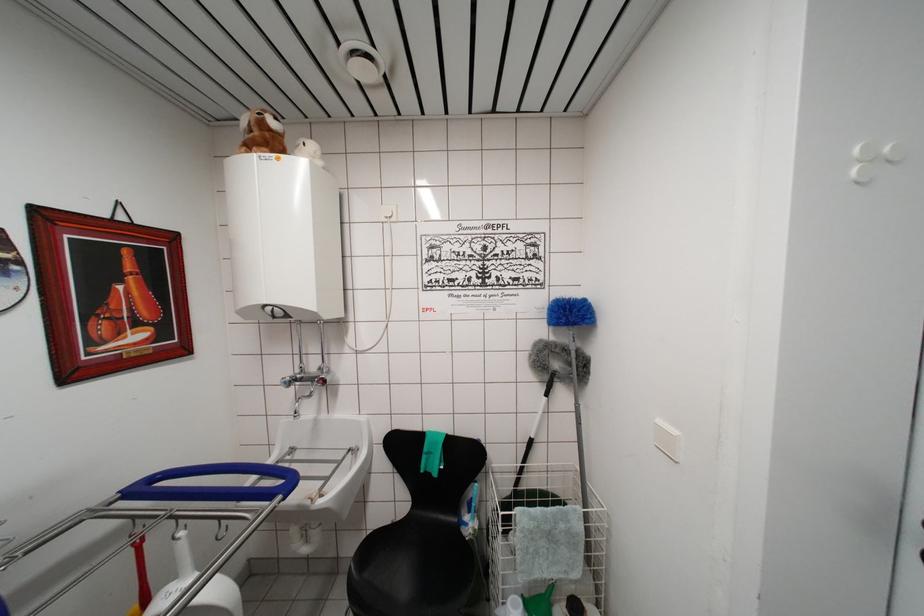
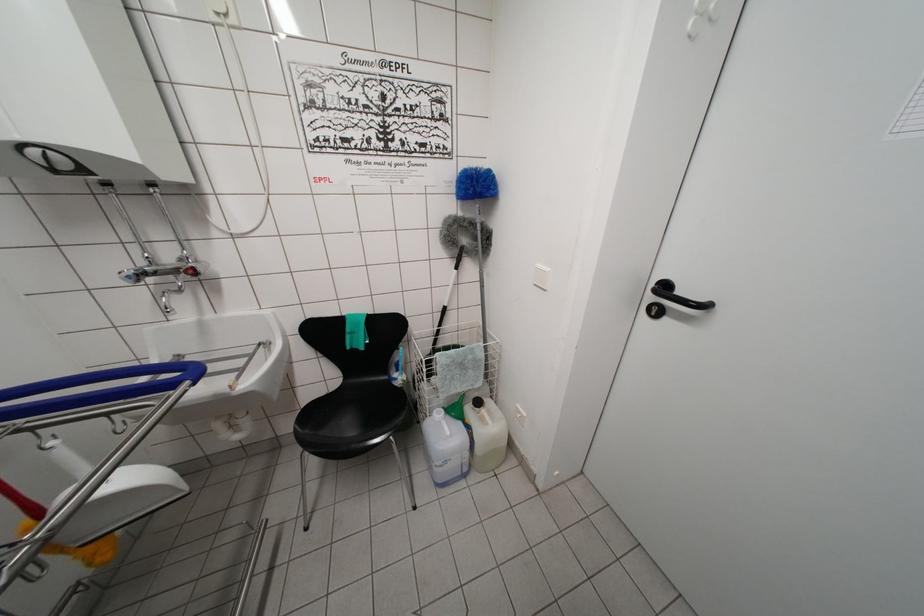
In the second image, find the point that corresponds to pixel 324 382 in the first image.

(193, 270)